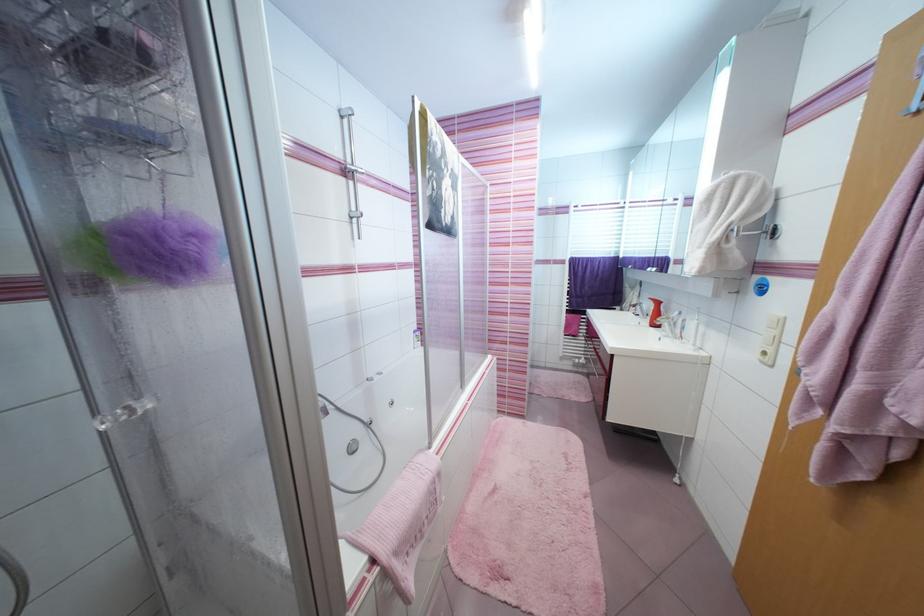
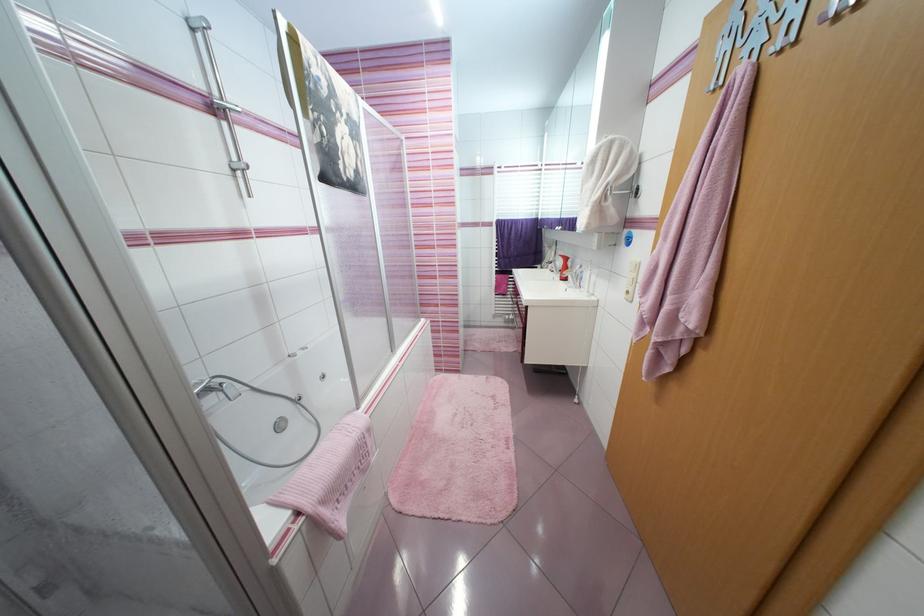
Question: The images are taken continuously from a first-person perspective. In which direction is your viewpoint rotating?

Choices:
 (A) Left
 (B) Right
 (C) Up
 (D) Down

Answer: (B)